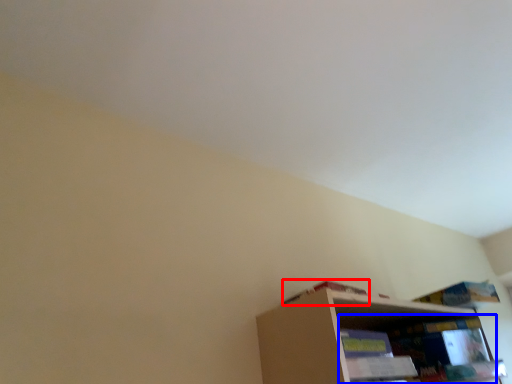
Question: Among these objects, which one is farthest to the camera, book (highlighted by a red box) or shelf (highlighted by a blue box)?

Choices:
 (A) book
 (B) shelf

Answer: (B)